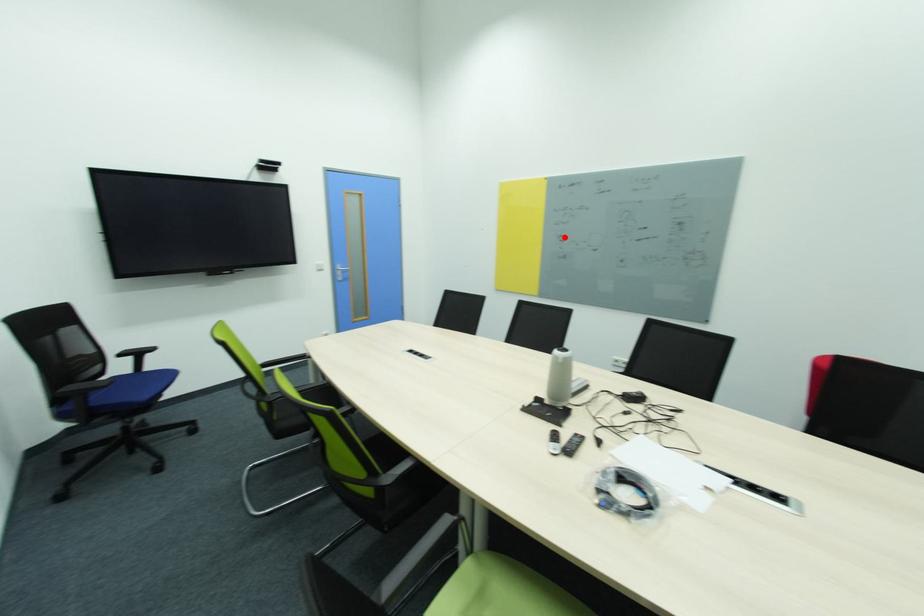
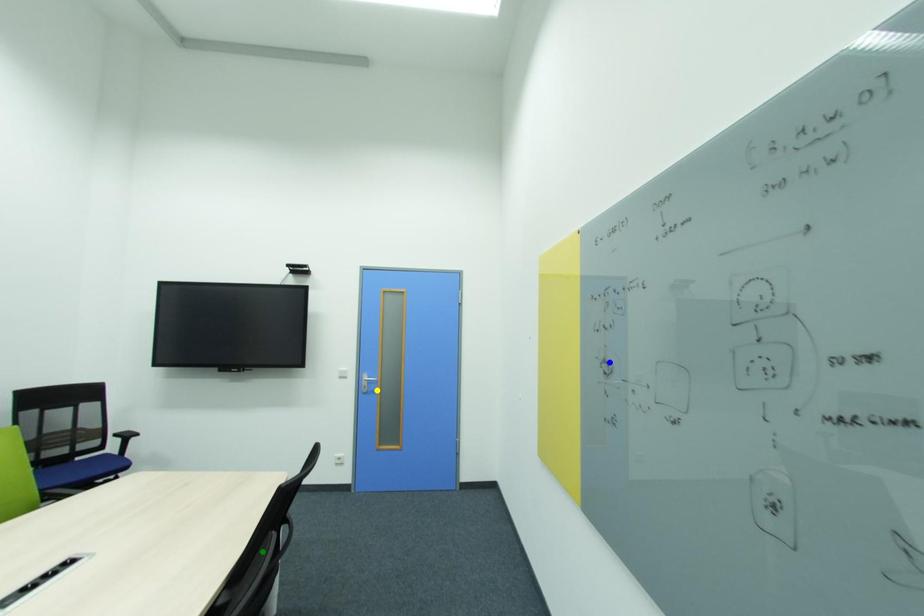
Question: I am providing you with two images of the same scene from different viewpoints. A red point is marked on the first image. You are given multiple points on the second image. Can you choose the point in image 2 that corresponds to the point in image 1?

Choices:
 (A) blue point
 (B) yellow point
 (C) green point

Answer: (A)